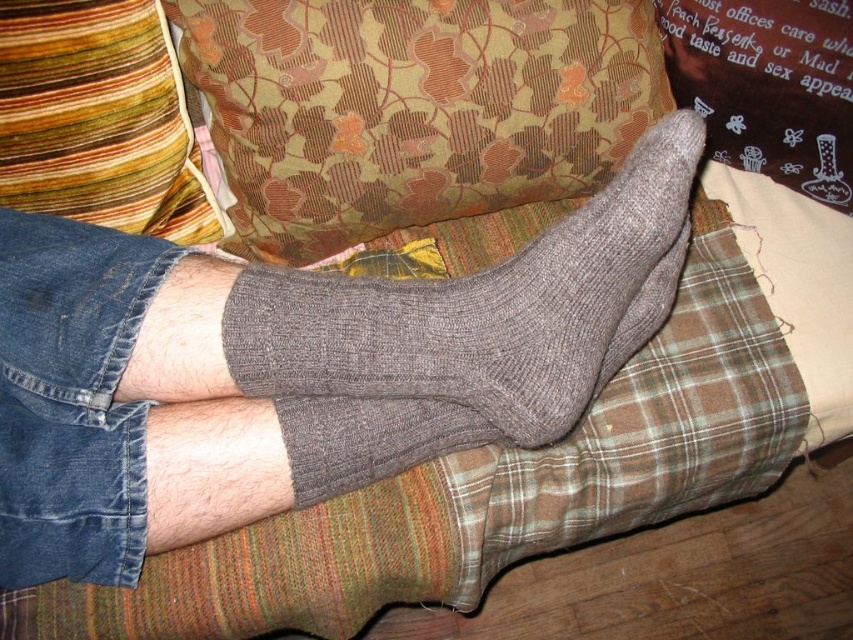
You are designing a living room layout and need to ensure that all decorative pillows are taller than any socks visible in the scene. Based on the image provided, does the brown textured pillow at upper center meet this requirement compared to the gray knitted sock at upper center?

The brown textured pillow at upper center is shorter than the gray knitted sock at upper center, so it does not meet the requirement of being taller than the sock.

Consider the image. You are trying to decide which pillow to use as a headrest while sitting on the couch. Based on their positions, which pillow is closer to you between the multicolored striped pillow at upper left and the brown textured pillow at upper center?

The brown textured pillow at upper center is closer to you because the multicolored striped pillow at upper left is positioned behind it.